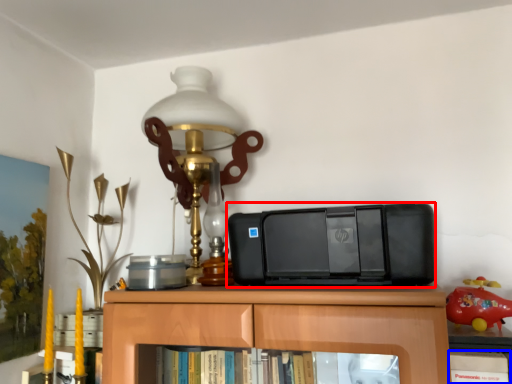
Question: Among these objects, which one is farthest to the camera, printer (highlighted by a red box) or book (highlighted by a blue box)?

Choices:
 (A) printer
 (B) book

Answer: (A)